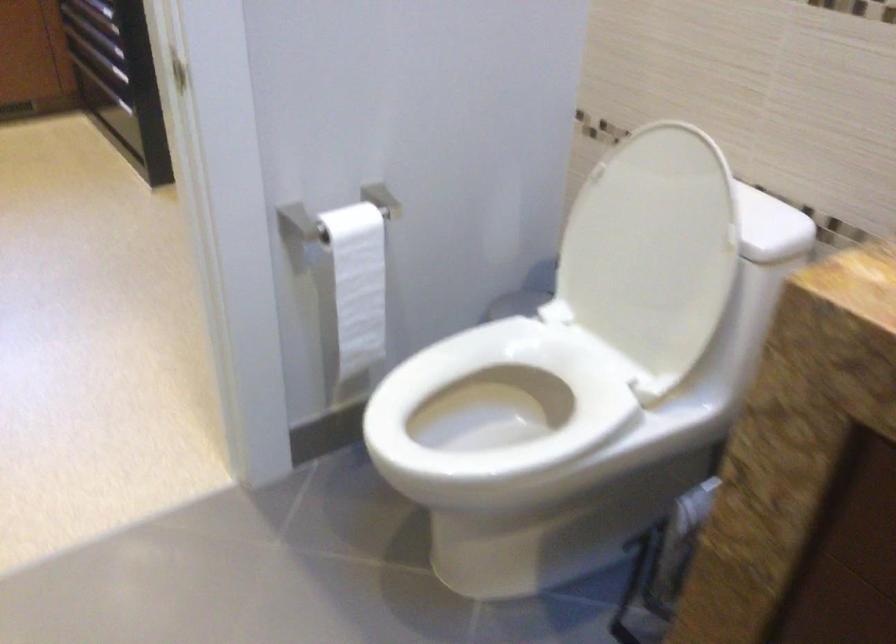
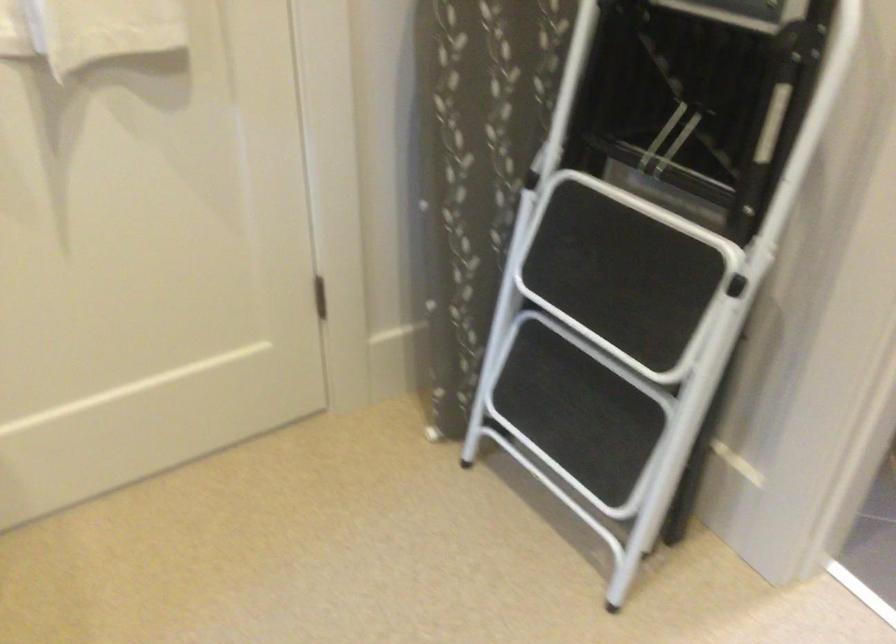
Question: I am providing you with two images of the same scene from different viewpoints. Which of the following objects are not visible in image2?

Choices:
 (A) white toilet seat
 (B) folding step ladder
 (C) white towel
 (D) small wooden tray

Answer: (A)